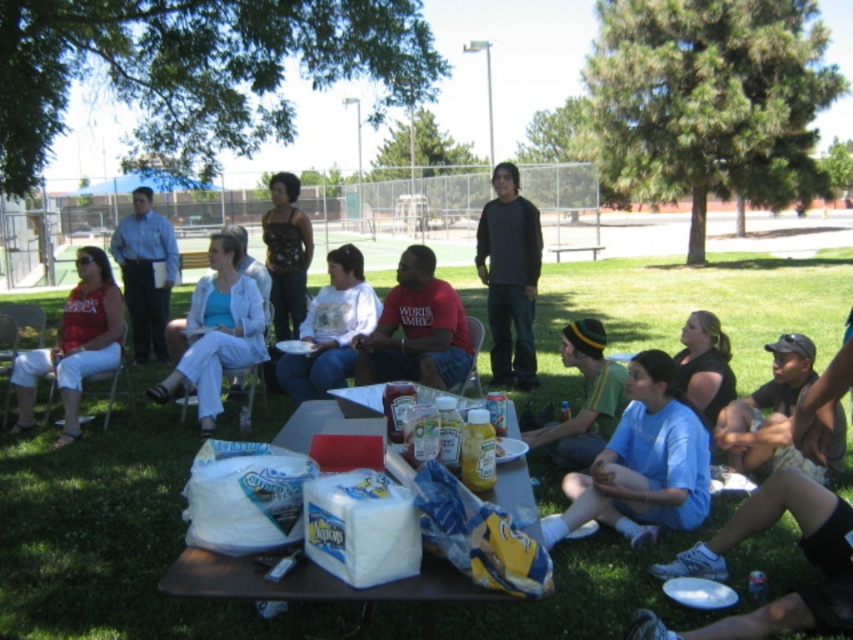
Can you confirm if brown wooden picnic table at center is shorter than dark gray long-sleeve shirt at center?

Correct, brown wooden picnic table at center is not as tall as dark gray long-sleeve shirt at center.

Does brown wooden picnic table at center have a smaller size compared to dark gray long-sleeve shirt at center?

Correct, brown wooden picnic table at center occupies less space than dark gray long-sleeve shirt at center.

This screenshot has height=640, width=853. I want to click on brown wooden picnic table at center, so click(314, 586).

This screenshot has width=853, height=640. What are the coordinates of `light blue fabric shirt at lower center` in the screenshot? It's located at (643, 464).

I want to click on light blue fabric shirt at lower center, so coord(643,464).

How much distance is there between green knit cap at center and black cotton shirt at lower right?

They are 26.63 inches apart.

Does point (611, 412) lie in front of point (701, 333)?

That is True.

Find the location of a particular element. The width and height of the screenshot is (853, 640). green knit cap at center is located at coordinates (584, 397).